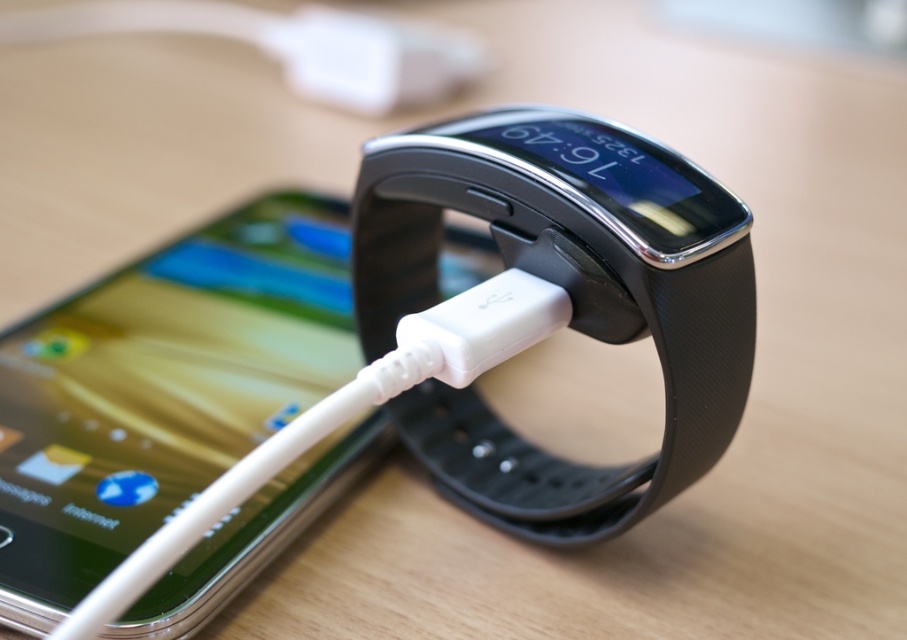
You are a delivery robot trying to place a package on the wooden surface. The package is 10 cm wide. The black rubber watch at center is currently occupying space at point 0.473, 0.626. Can you place the package without moving the watch?

The black rubber watch at center is located at point (567, 301). Since the package is 10 cm wide, it depends on the available space around the watch. However, without knowing the exact dimensions of the wooden surface or the distance between other objects, it is impossible to determine if there is enough space to place the package without moving the watch.

You are a delivery robot that needs to pick up the black rubber watch at center and the white plastic usb cable at center from the wooden surface. What is the minimum distance you need to move to collect both items?

The black rubber watch at center and the white plastic usb cable at center are 8.42 inches apart from each other. To collect both items, the delivery robot needs to move at least 8.42 inches between them.